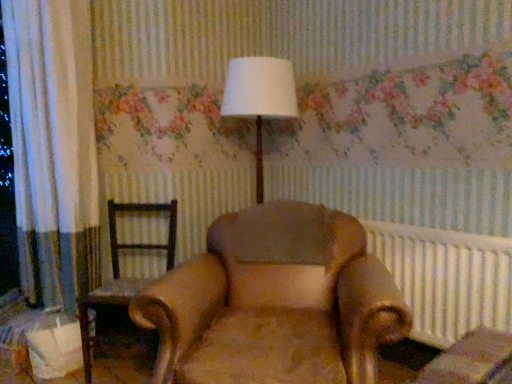
Question: Can you confirm if white fabric lampshade at center is shorter than white plastic radiator at right?

Choices:
 (A) no
 (B) yes

Answer: (A)

Question: Is white fabric lampshade at center outside white plastic radiator at right?

Choices:
 (A) yes
 (B) no

Answer: (A)

Question: From the image's perspective, is white fabric lampshade at center located above white plastic radiator at right?

Choices:
 (A) yes
 (B) no

Answer: (A)

Question: From a real-world perspective, is white fabric lampshade at center on white plastic radiator at right?

Choices:
 (A) yes
 (B) no

Answer: (A)

Question: Is the position of white fabric lampshade at center less distant than that of white plastic radiator at right?

Choices:
 (A) no
 (B) yes

Answer: (A)

Question: Is white fabric lampshade at center taller than white plastic radiator at right?

Choices:
 (A) no
 (B) yes

Answer: (B)

Question: From the image's perspective, does brown leather chair at left, placed as the second chair when sorted from right to left, appear higher than white fabric lampshade at center?

Choices:
 (A) yes
 (B) no

Answer: (B)

Question: Is brown leather chair at left, placed as the second chair when sorted from right to left, not close to white fabric lampshade at center?

Choices:
 (A) no
 (B) yes

Answer: (A)

Question: Can you confirm if brown leather chair at left, positioned as the 1th chair in left-to-right order, is smaller than white fabric lampshade at center?

Choices:
 (A) yes
 (B) no

Answer: (A)

Question: Considering the relative sizes of brown leather chair at left, placed as the second chair when sorted from right to left, and white fabric lampshade at center in the image provided, is brown leather chair at left, placed as the second chair when sorted from right to left, bigger than white fabric lampshade at center?

Choices:
 (A) yes
 (B) no

Answer: (B)

Question: Does brown leather chair at left, positioned as the 1th chair in left-to-right order, touch white fabric lampshade at center?

Choices:
 (A) yes
 (B) no

Answer: (B)

Question: From a real-world perspective, is brown leather chair at left, placed as the second chair when sorted from right to left, over white fabric lampshade at center?

Choices:
 (A) no
 (B) yes

Answer: (A)

Question: Is leather armchair at center, the second chair viewed from the left, not inside brown leather chair at left, positioned as the 1th chair in left-to-right order?

Choices:
 (A) no
 (B) yes

Answer: (B)